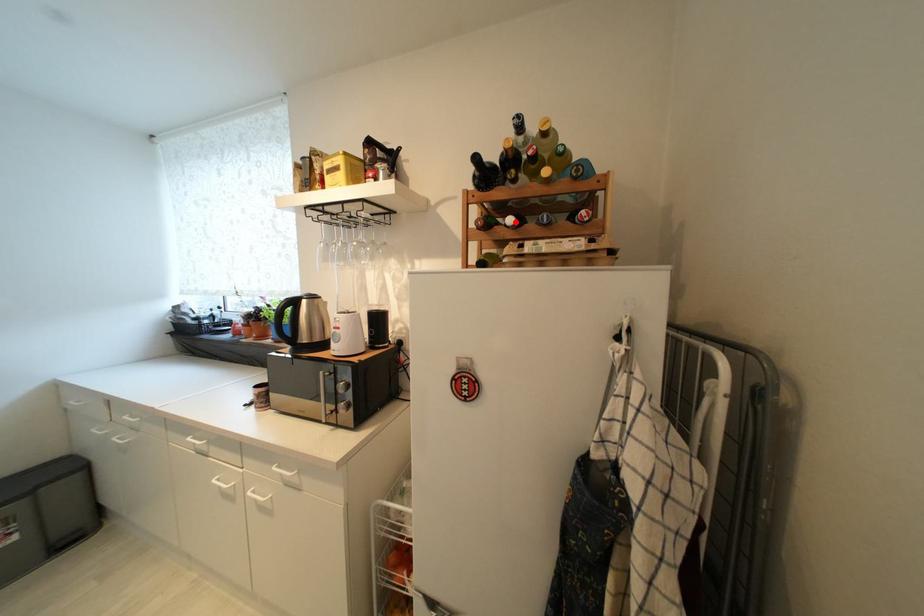
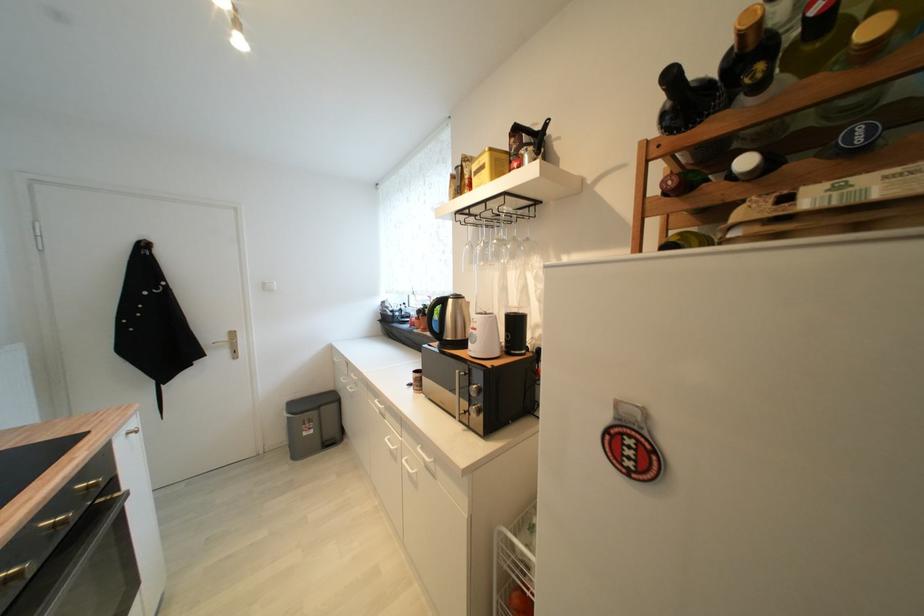
Where in the second image is the point corresponding to the highlighted location from the first image?

(751, 164)